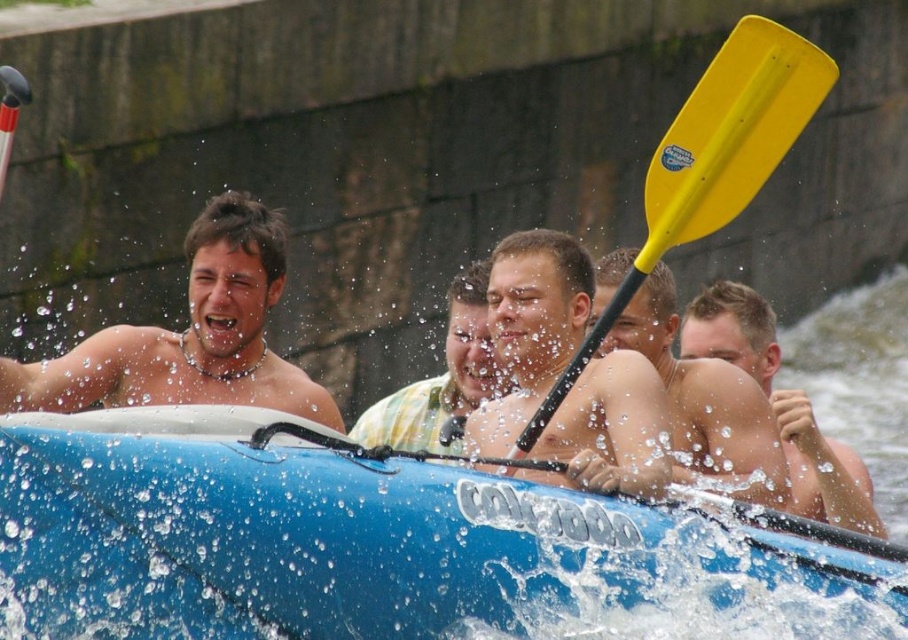
You are a rafting guide observing the yellow plastic paddle at center and the yellow matte paddle at center in the raft. Which paddle is wider?

The yellow plastic paddle at center is wider than the yellow matte paddle at center.

You are planning to take a group photo of the blue plastic kayak at center and the shiny silver necklace at left. Since you want to ensure both are clearly visible, which object should you focus on first to avoid blurriness?

The shiny silver necklace at left should be focused on first because it is larger and thus easier to capture clearly.

You are a photographer taking a picture of the shiny silver necklace at left and the smooth tan skin at center. Which object will appear closer to the camera in the photo?

The shiny silver necklace at left will appear closer to the camera because it is in front of the smooth tan skin at center.